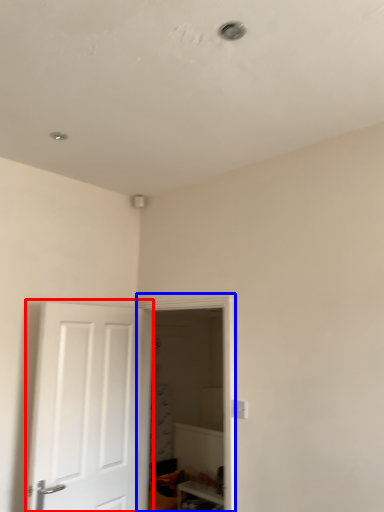
Question: Among these objects, which one is nearest to the camera, door (highlighted by a red box) or glass door (highlighted by a blue box)?

Choices:
 (A) door
 (B) glass door

Answer: (A)